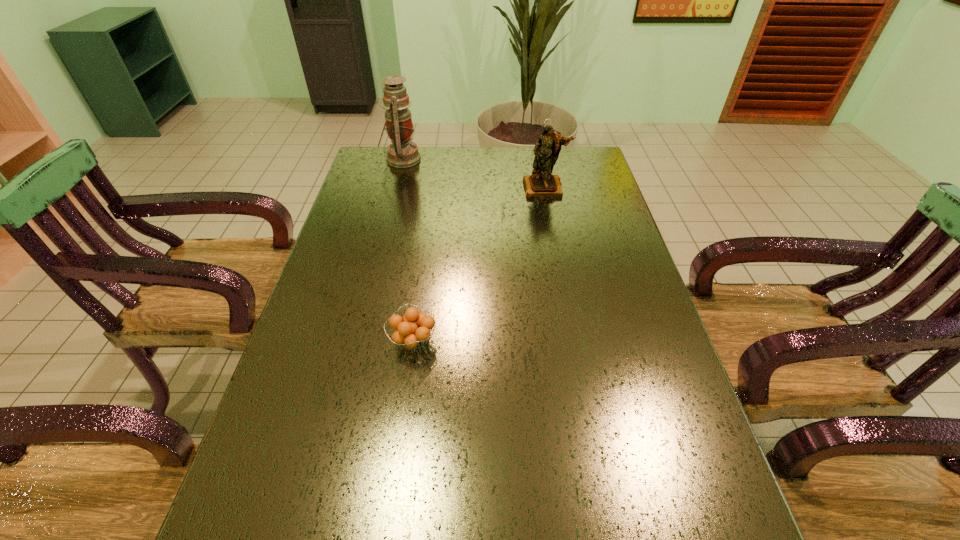
You are a GUI agent. You are given a task and a screenshot of the screen. Output one action in this format:
    pyautogui.click(x=<x>, y=<y>)
    Task: Click on the vacant area that lies between the rightmost object and the nearest object
    This screenshot has width=960, height=540.
    Given the screenshot: What is the action you would take?
    pyautogui.click(x=479, y=265)

This screenshot has height=540, width=960. Find the location of `empty location between the leftmost object and the second nearest object`. empty location between the leftmost object and the second nearest object is located at coordinates (473, 174).

This screenshot has width=960, height=540. Identify the location of free spot between the second farthest object and the tallest object. point(473,174).

What are the coordinates of `vacant area between the farthest object and the nearest object` in the screenshot? It's located at coord(407,250).

In order to click on empty space that is in between the farthest object and the nearest object in this screenshot , I will do `click(407, 250)`.

Image resolution: width=960 pixels, height=540 pixels. In order to click on vacant area that lies between the nearest object and the rightmost object in this screenshot , I will do `click(479, 265)`.

You are a GUI agent. You are given a task and a screenshot of the screen. Output one action in this format:
    pyautogui.click(x=<x>, y=<y>)
    Task: Click on the vacant space that's between the leftmost object and the shortest object
    
    Given the screenshot: What is the action you would take?
    pyautogui.click(x=407, y=250)

Locate an element on the screen. empty space between the leftmost object and the second shortest object is located at coordinates (473, 174).

Find the location of a particular element. The width and height of the screenshot is (960, 540). blank region between the rightmost object and the tallest object is located at coordinates (473, 174).

Image resolution: width=960 pixels, height=540 pixels. Find the location of `the closest object to the rightmost object`. the closest object to the rightmost object is located at coordinates (402, 153).